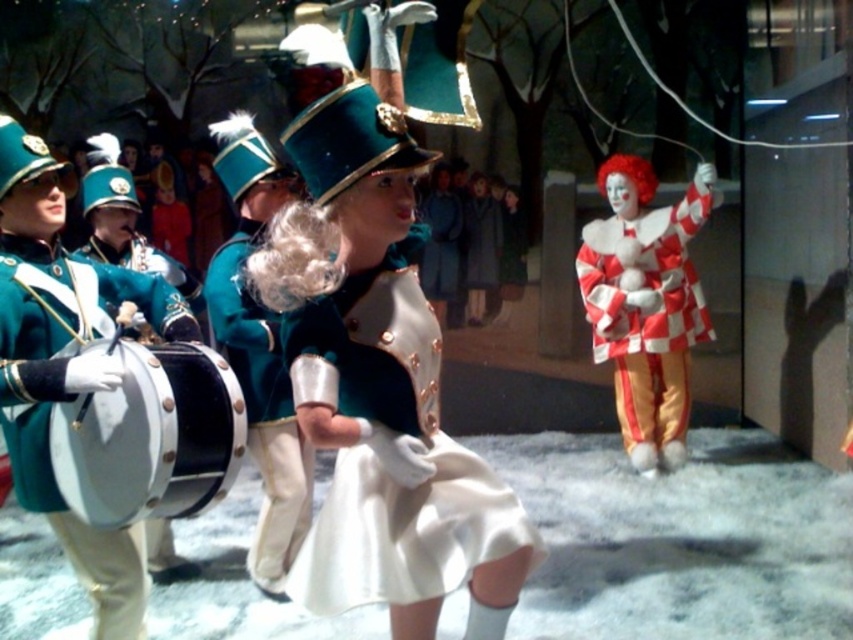
Question: Does green fabric drum at left have a greater width compared to green matte uniform at center?

Choices:
 (A) yes
 (B) no

Answer: (A)

Question: Is green fabric drum at left positioned at the back of green matte uniform at center?

Choices:
 (A) no
 (B) yes

Answer: (A)

Question: Which object is closer to the camera taking this photo?

Choices:
 (A) green matte uniform at center
 (B) shiny black drum at left
 (C) green fabric drum at left
 (D) checkered fabric clown at right

Answer: (B)

Question: Which object is farther from the camera taking this photo?

Choices:
 (A) shiny black drum at left
 (B) checkered fabric clown at right
 (C) green fabric drum at left
 (D) green matte uniform at center

Answer: (B)

Question: Which object appears farthest from the camera in this image?

Choices:
 (A) green matte uniform at center
 (B) shiny black drum at left
 (C) checkered fabric clown at right

Answer: (C)

Question: Can you confirm if checkered fabric clown at right is positioned to the right of green matte uniform at center?

Choices:
 (A) yes
 (B) no

Answer: (A)